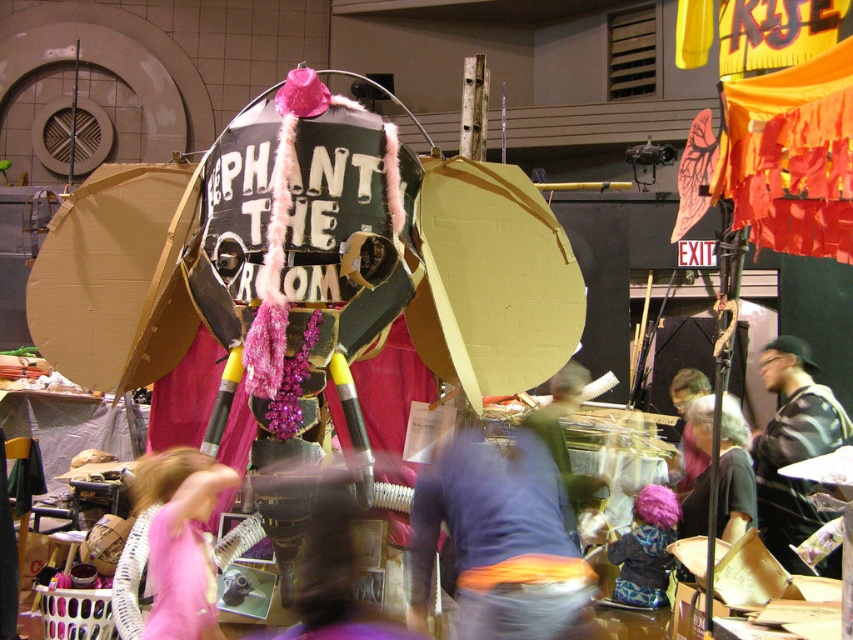
Does point (514, 461) come farther from viewer compared to point (689, 387)?

No, (514, 461) is in front of (689, 387).

Based on the photo, who is more forward, (534,449) or (703,468)?

Point (534,449)

Locate an element on the screen. orange fabric belt at center is located at coordinates (500, 540).

Find the location of a particular element. orange fabric belt at center is located at coordinates (500, 540).

Can you confirm if orange fabric belt at center is positioned to the left of plush pink wig at center?

Yes, orange fabric belt at center is to the left of plush pink wig at center.

Who is positioned more to the left, orange fabric belt at center or plush pink wig at center?

Positioned to the left is orange fabric belt at center.

Is point (433, 547) farther from viewer compared to point (650, 497)?

No, (433, 547) is closer to viewer.

Locate an element on the screen. This screenshot has width=853, height=640. orange fabric belt at center is located at coordinates (500, 540).

Who is lower down, gray fabric wig at center or matte pink wig at center?

gray fabric wig at center is lower down.

Can you confirm if gray fabric wig at center is smaller than matte pink wig at center?

No.

Image resolution: width=853 pixels, height=640 pixels. I want to click on gray fabric wig at center, so click(x=734, y=474).

Identify the location of gray fabric wig at center. (734, 474).